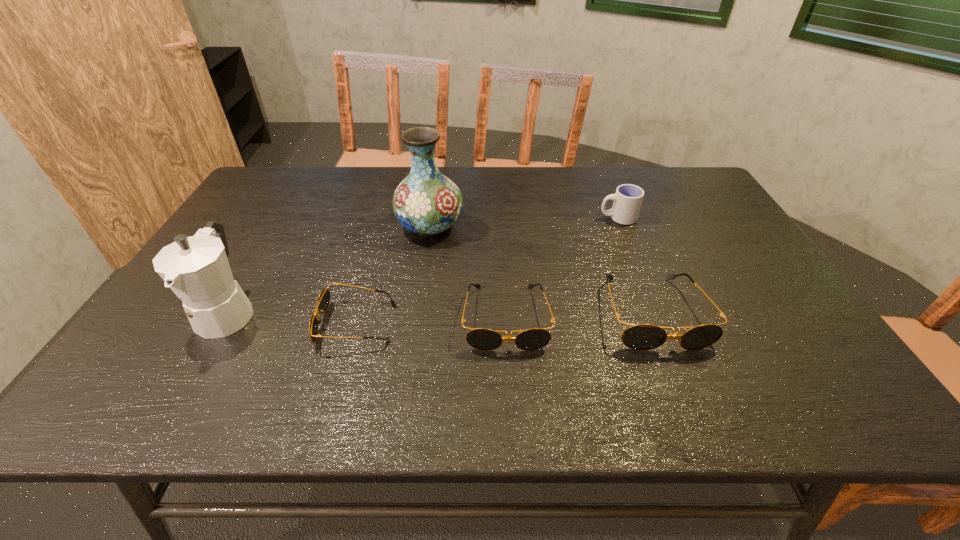
What are the coordinates of `free spot between the rightmost sunglasses and the coffeepot` in the screenshot? It's located at (440, 312).

The width and height of the screenshot is (960, 540). Find the location of `vacant area that lies between the vase and the second shortest object`. vacant area that lies between the vase and the second shortest object is located at coordinates (468, 272).

What are the coordinates of `vacant area that lies between the fifth shortest object and the shortest sunglasses` in the screenshot? It's located at (292, 318).

Find the location of a particular element. Image resolution: width=960 pixels, height=540 pixels. free space between the vase and the second tallest object is located at coordinates 329,268.

Where is `object that stands as the second closest to the leftmost object`? object that stands as the second closest to the leftmost object is located at coordinates (426, 202).

Locate which object is the fifth closest to the third object from right to left. Please provide its 2D coordinates. Your answer should be formatted as a tuple, i.e. [(x, y)], where the tuple contains the x and y coordinates of a point satisfying the conditions above.

[(196, 268)]

I want to click on the third closest sunglasses relative to the leftmost object, so click(x=642, y=337).

Locate which sunglasses ranks second in proximity to the cup. Please provide its 2D coordinates. Your answer should be formatted as a tuple, i.e. [(x, y)], where the tuple contains the x and y coordinates of a point satisfying the conditions above.

[(484, 339)]

Where is `vacant area in the image that satisfies the following two spatial constraints: 1. with the handle on the side of the cup; 2. at the spout of the leftmost object`? vacant area in the image that satisfies the following two spatial constraints: 1. with the handle on the side of the cup; 2. at the spout of the leftmost object is located at coordinates 656,312.

At what (x,y) coordinates should I click in order to perform the action: click on vacant space that satisfies the following two spatial constraints: 1. with the handle on the side of the cup; 2. on the front-facing side of the second shortest sunglasses. Please return your answer as a coordinate pair (x, y). Looking at the image, I should click on (659, 318).